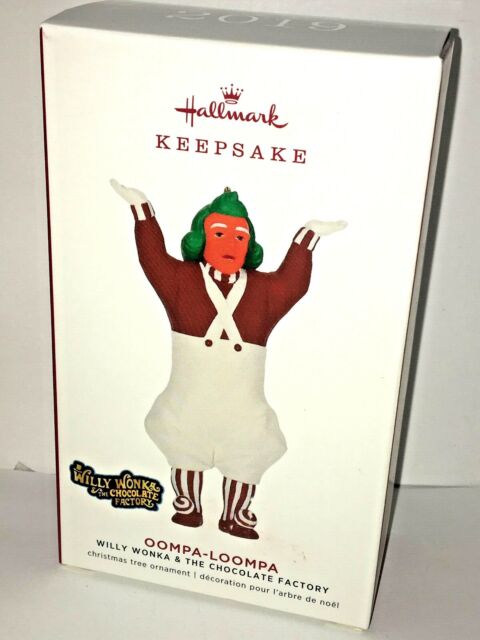
Locate an element on the screen. This screenshot has height=640, width=480. wall is located at coordinates (33, 363).